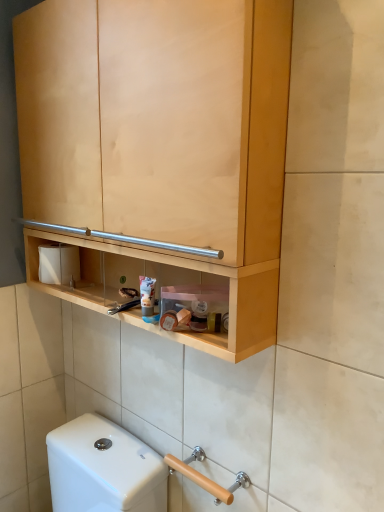
Question: Considering the relative positions of white matte toilet paper at left and beige wood grab bar at lower right in the image provided, is white matte toilet paper at left to the right of beige wood grab bar at lower right from the viewer's perspective?

Choices:
 (A) no
 (B) yes

Answer: (A)

Question: From a real-world perspective, is white matte toilet paper at left positioned under beige wood grab bar at lower right based on gravity?

Choices:
 (A) no
 (B) yes

Answer: (A)

Question: Considering the relative sizes of white matte toilet paper at left and beige wood grab bar at lower right in the image provided, is white matte toilet paper at left wider than beige wood grab bar at lower right?

Choices:
 (A) no
 (B) yes

Answer: (B)

Question: Considering the relative positions of white matte toilet paper at left and beige wood grab bar at lower right in the image provided, is white matte toilet paper at left to the left of beige wood grab bar at lower right from the viewer's perspective?

Choices:
 (A) no
 (B) yes

Answer: (B)

Question: Can you confirm if white matte toilet paper at left is thinner than beige wood grab bar at lower right?

Choices:
 (A) no
 (B) yes

Answer: (A)

Question: Could you tell me if white matte toilet paper at left is turned towards beige wood grab bar at lower right?

Choices:
 (A) yes
 (B) no

Answer: (B)

Question: Considering the relative sizes of natural wood cabinet at upper center and beige wood grab bar at lower right in the image provided, is natural wood cabinet at upper center bigger than beige wood grab bar at lower right?

Choices:
 (A) yes
 (B) no

Answer: (A)

Question: Is natural wood cabinet at upper center far from beige wood grab bar at lower right?

Choices:
 (A) yes
 (B) no

Answer: (B)

Question: From a real-world perspective, is natural wood cabinet at upper center under beige wood grab bar at lower right?

Choices:
 (A) no
 (B) yes

Answer: (A)

Question: Is the depth of natural wood cabinet at upper center greater than that of beige wood grab bar at lower right?

Choices:
 (A) yes
 (B) no

Answer: (B)

Question: From the image's perspective, is natural wood cabinet at upper center beneath beige wood grab bar at lower right?

Choices:
 (A) no
 (B) yes

Answer: (A)

Question: Is natural wood cabinet at upper center at the right side of beige wood grab bar at lower right?

Choices:
 (A) yes
 (B) no

Answer: (B)

Question: From the image's perspective, is white matte toilet paper at left beneath matte plastic tube at center?

Choices:
 (A) no
 (B) yes

Answer: (A)